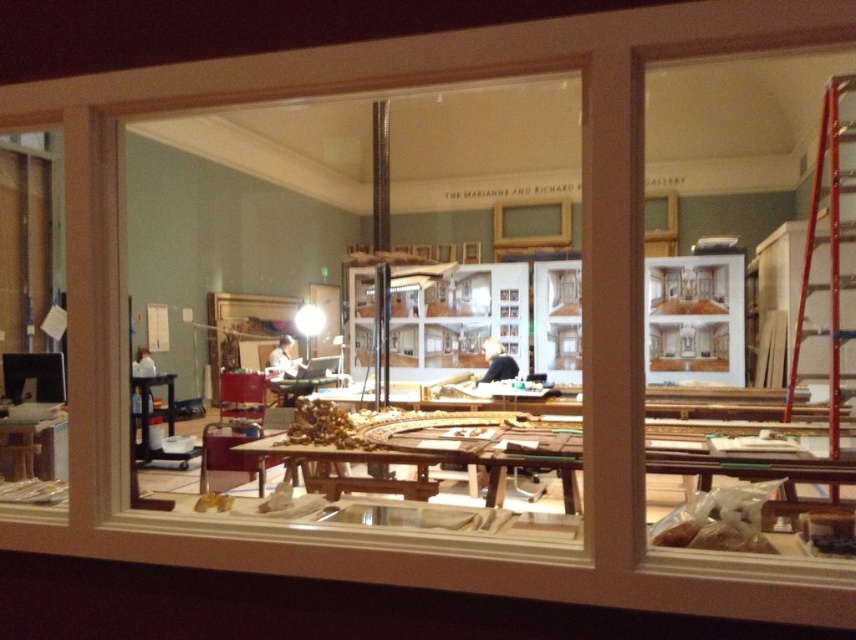
You are an interior designer who needs to move a large piece of furniture through the space. You see the red metal ladder at right and the black fabric at center. Which object should you avoid moving first to create more space?

The red metal ladder at right is bigger than the black fabric at center, so you should move the red metal ladder at right first to create more space.

You are an interior designer who needs to move a large painting from the wall to the floor. You have a red metal ladder at right and a black fabric at center. Which object should you use to safely lower the painting to the floor without damaging it?

You should use the black fabric at center to safely lower the painting to the floor because the red metal ladder at right might be wider than the black fabric at center, making the ladder less stable for this task.